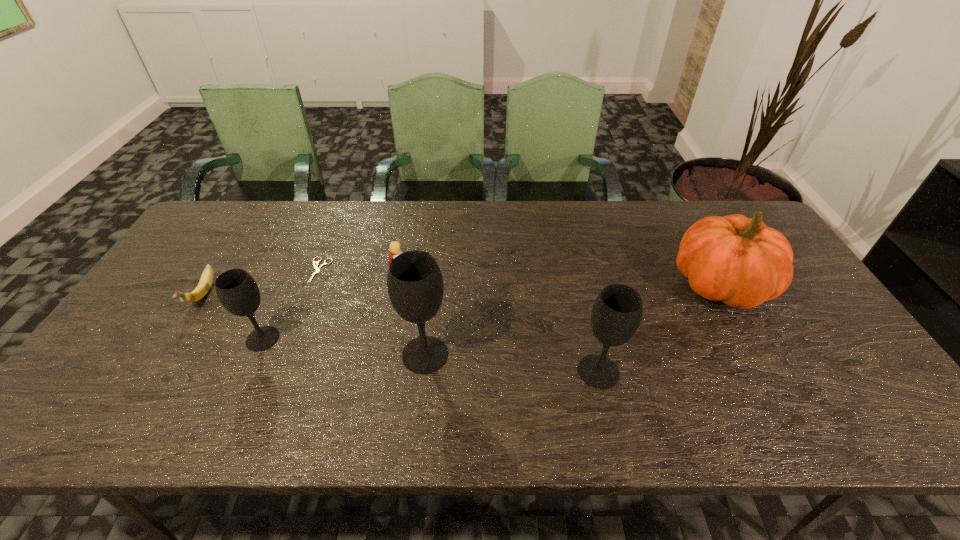
At what (x,y) coordinates should I click in order to perform the action: click on vacant region between the fifth object from right to left and the fourth tallest object. Please return your answer as a coordinate pair (x, y). Looking at the image, I should click on (291, 305).

Identify the location of free spot between the second object from right to left and the rightmost object. (660, 329).

I want to click on vacant area that lies between the rightmost object and the banana, so click(x=461, y=291).

Locate an element on the screen. This screenshot has width=960, height=540. empty space that is in between the fifth object from left to right and the shears is located at coordinates (372, 313).

Identify the location of free space between the pumpkin and the Lego. This screenshot has height=540, width=960. (561, 279).

What are the coordinates of `object identified as the sixth closest to the pumpkin` in the screenshot? It's located at (201, 290).

Choose which object is the fifth nearest neighbor to the second object from right to left. Please provide its 2D coordinates. Your answer should be formatted as a tuple, i.e. [(x, y)], where the tuple contains the x and y coordinates of a point satisfying the conditions above.

[(236, 289)]

At what (x,y) coordinates should I click in order to perform the action: click on wineglass that is the closest one to the third object from right to left. Please return your answer as a coordinate pair (x, y). This screenshot has height=540, width=960. Looking at the image, I should click on (616, 314).

Choose which wineglass is the nearest neighbor to the rightmost wineglass. Please provide its 2D coordinates. Your answer should be formatted as a tuple, i.e. [(x, y)], where the tuple contains the x and y coordinates of a point satisfying the conditions above.

[(415, 286)]

Identify the location of vacant area in the image that satisfies the following two spatial constraints: 1. on the front-facing side of the third shortest object; 2. on the back side of the rightmost object. pyautogui.click(x=398, y=286).